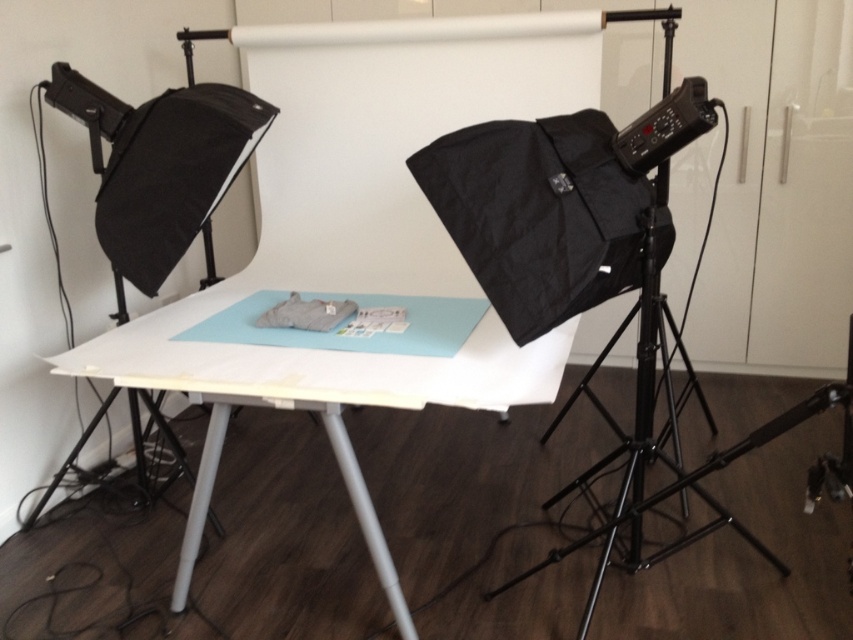
Question: Which object is the closest to the black metal tripod at right?

Choices:
 (A) black plastic light at upper right
 (B) white matte table at center

Answer: (B)

Question: Estimate the real-world distances between objects in this image. Which object is farther from the black plastic light at upper right?

Choices:
 (A) white matte table at center
 (B) black metal tripod at right

Answer: (A)

Question: Can you confirm if white matte table at center is positioned above black plastic light at upper right?

Choices:
 (A) yes
 (B) no

Answer: (B)

Question: Can you confirm if white matte table at center is thinner than black metal tripod at right?

Choices:
 (A) no
 (B) yes

Answer: (A)

Question: Which object is farther from the camera taking this photo?

Choices:
 (A) white matte table at center
 (B) black metal tripod at right
 (C) black plastic light at upper right

Answer: (B)

Question: Observing the image, what is the correct spatial positioning of white matte table at center in reference to black metal tripod at right?

Choices:
 (A) left
 (B) right

Answer: (A)